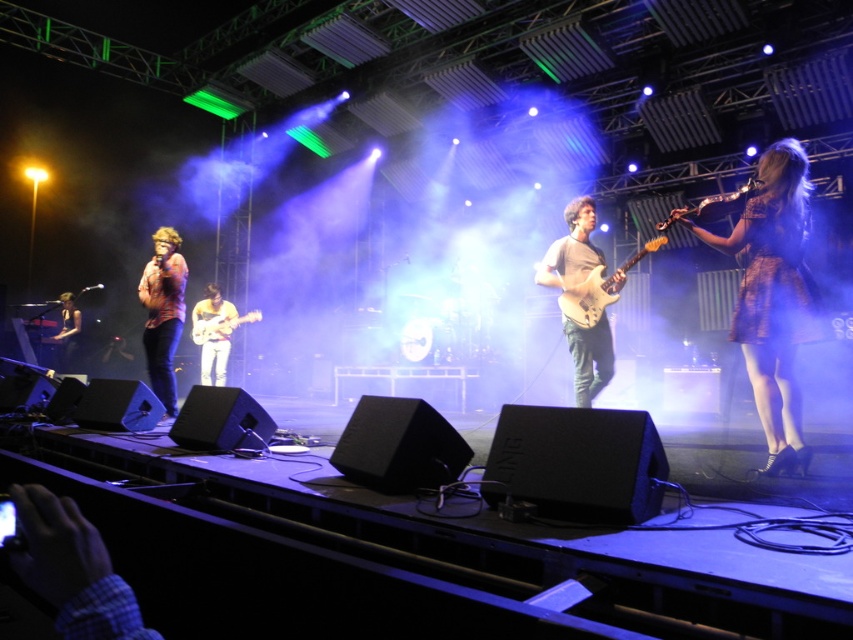
Does light brown leather guitar at center have a lesser width compared to shiny silver guitar at right?

In fact, light brown leather guitar at center might be wider than shiny silver guitar at right.

Between light brown leather guitar at center and shiny silver guitar at right, which one appears on the left side from the viewer's perspective?

Positioned to the left is light brown leather guitar at center.

Is point (219, 372) positioned before point (718, 214)?

No.

Where is `light brown leather guitar at center`? This screenshot has width=853, height=640. light brown leather guitar at center is located at coordinates (213, 333).

Between light brown leather guitar at center and matte white electric guitar at center, which one is positioned higher?

matte white electric guitar at center is higher up.

Looking at this image, between light brown leather guitar at center and matte white electric guitar at center, which one has less height?

With less height is matte white electric guitar at center.

The height and width of the screenshot is (640, 853). In order to click on light brown leather guitar at center in this screenshot , I will do `click(213, 333)`.

The image size is (853, 640). I want to click on light brown leather guitar at center, so click(213, 333).

Which is above, striped shirt at center or matte black guitar at left?

striped shirt at center

Who is more forward, (169,317) or (67,316)?

Point (169,317)

You are a GUI agent. You are given a task and a screenshot of the screen. Output one action in this format:
    pyautogui.click(x=<x>, y=<y>)
    Task: Click on the striped shirt at center
    The image size is (853, 640).
    Given the screenshot: What is the action you would take?
    pyautogui.click(x=163, y=314)